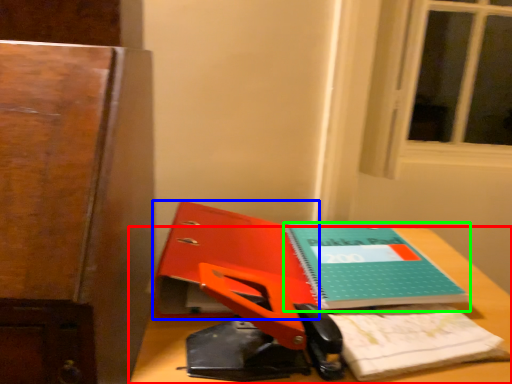
Question: Considering the real-world distances, which object is closest to desk (highlighted by a red box)? paperback book (highlighted by a blue box) or book (highlighted by a green box).

Choices:
 (A) paperback book
 (B) book

Answer: (B)